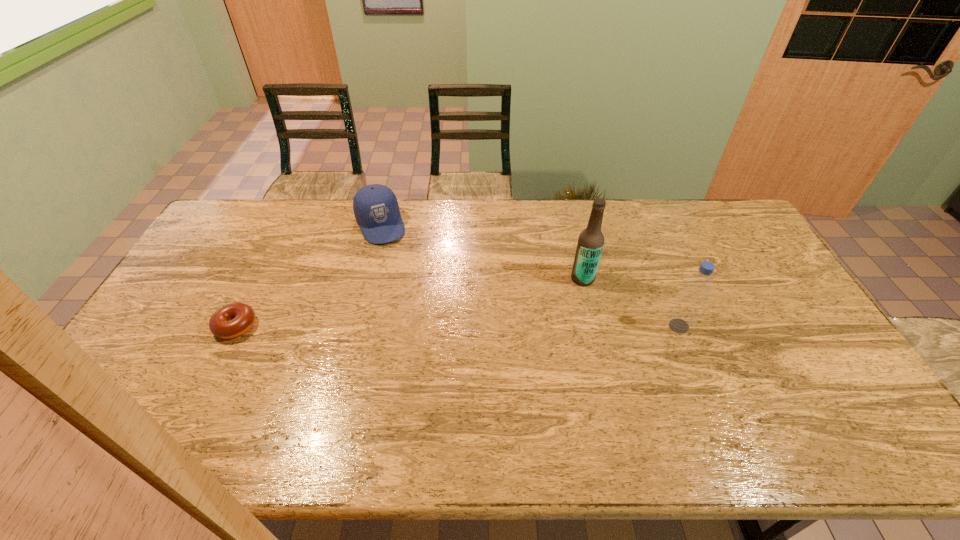
In the image, there is a desktop. At what (x,y) coordinates should I click in order to perform the action: click on vacant space at the right edge. Please return your answer as a coordinate pair (x, y). This screenshot has height=540, width=960. Looking at the image, I should click on (746, 240).

The width and height of the screenshot is (960, 540). In the image, there is a desktop. Find the location of `vacant space at the far left corner`. vacant space at the far left corner is located at coordinates (254, 230).

Where is `free space at the near left corner`? Image resolution: width=960 pixels, height=540 pixels. free space at the near left corner is located at coordinates (152, 381).

The width and height of the screenshot is (960, 540). I want to click on vacant space at the far right corner of the desktop, so click(716, 222).

The height and width of the screenshot is (540, 960). I want to click on vacant area that lies between the bottle and the farthest object, so click(x=530, y=275).

Locate an element on the screen. This screenshot has width=960, height=540. vacant area that lies between the third object from right to left and the rightmost object is located at coordinates (530, 275).

Find the location of a particular element. free space between the rightmost object and the shortest object is located at coordinates (457, 326).

You are a GUI agent. You are given a task and a screenshot of the screen. Output one action in this format:
    pyautogui.click(x=<x>, y=<y>)
    Task: Click on the empty location between the second shortest object and the rightmost object
    
    Given the screenshot: What is the action you would take?
    pyautogui.click(x=530, y=275)

This screenshot has height=540, width=960. In order to click on free space between the doughnut and the second tallest object in this screenshot , I will do `click(457, 326)`.

At what (x,y) coordinates should I click in order to perform the action: click on free space between the farthest object and the second tallest object. Please return your answer as a coordinate pair (x, y). Image resolution: width=960 pixels, height=540 pixels. Looking at the image, I should click on (530, 275).